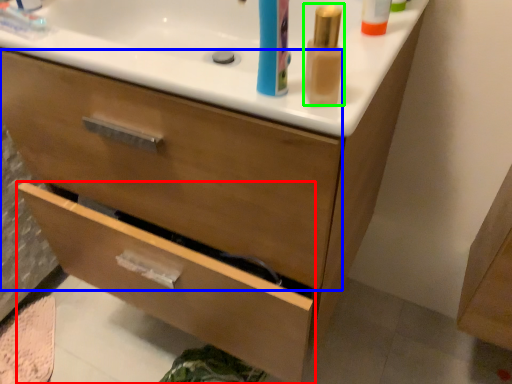
Question: Which object is the closest to the drawer (highlighted by a red box)? Choose among these: drawer (highlighted by a blue box) or mouthwash (highlighted by a green box).

Choices:
 (A) drawer
 (B) mouthwash

Answer: (A)